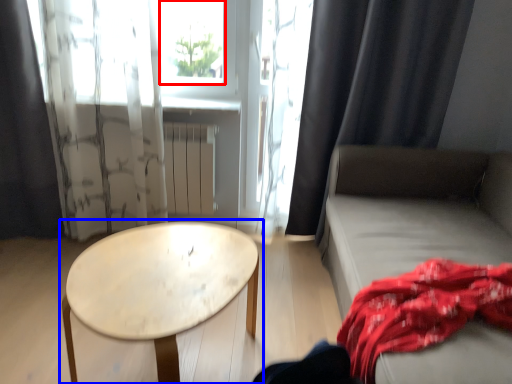
Question: Which of the following is the farthest to the observer, window screen (highlighted by a red box) or table (highlighted by a blue box)?

Choices:
 (A) window screen
 (B) table

Answer: (A)